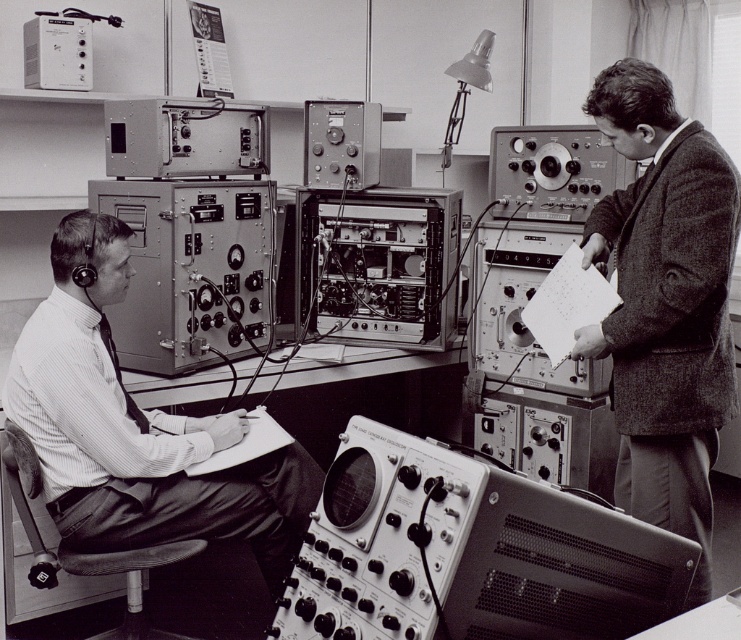
You are a lab assistant who needs to locate the point at coordinates (664, 301) in the vintage laboratory. According to the scene description, where exactly is this point located?

The point at coordinates (664, 301) is located on the textured wool blazer at center right.

You are a technician in this lab and need to place a new device that is 1.2 meters wide on the desk. The desk currently has the metallic silver oscilloscope at center and the matte black shirt at left. Can the new device fit on the desk if it must be placed between these two objects?

The metallic silver oscilloscope at center is wider than the matte black shirt at left. Since the oscilloscope is already occupying more space, there might not be enough room for the new device unless the existing items are rearranged. However, without knowing the exact dimensions of the desk and the distance between the objects, it is difficult to determine if the 1.2 meter wide device can fit between them.